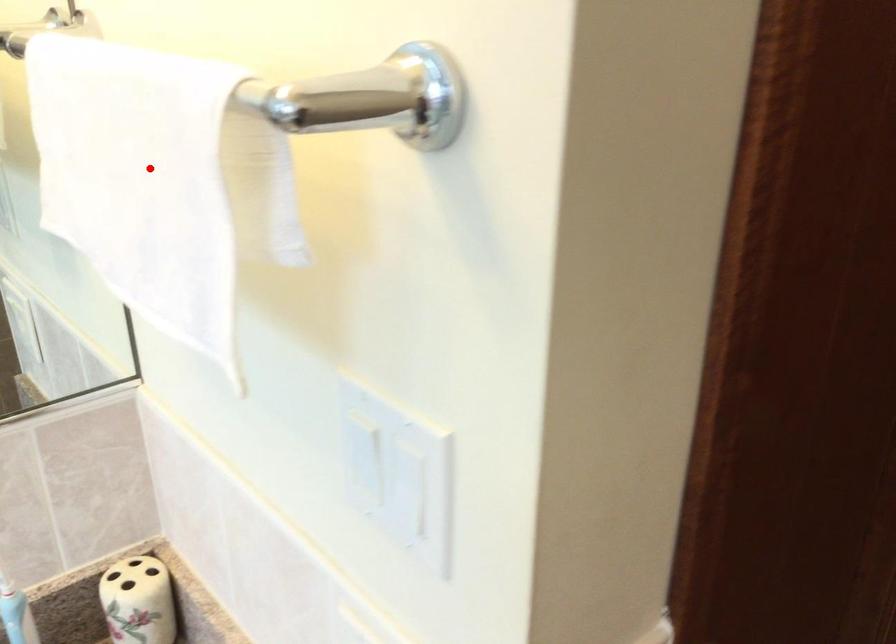
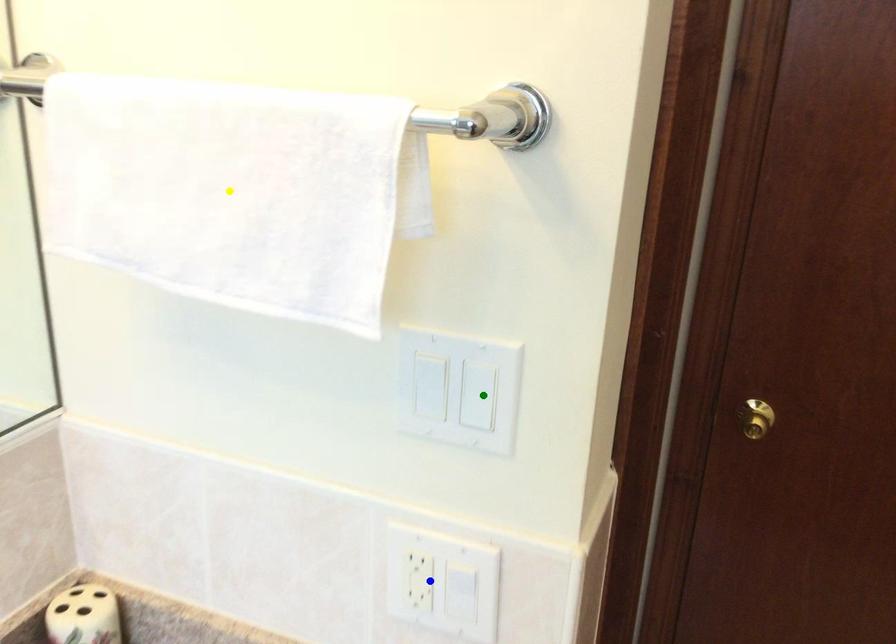
Question: I am providing you with two images of the same scene from different viewpoints. A red point is marked on the first image. You are given multiple points on the second image. Which point in image 2 is actually the same real-world point as the red point in image 1?

Choices:
 (A) green point
 (B) yellow point
 (C) blue point

Answer: (B)